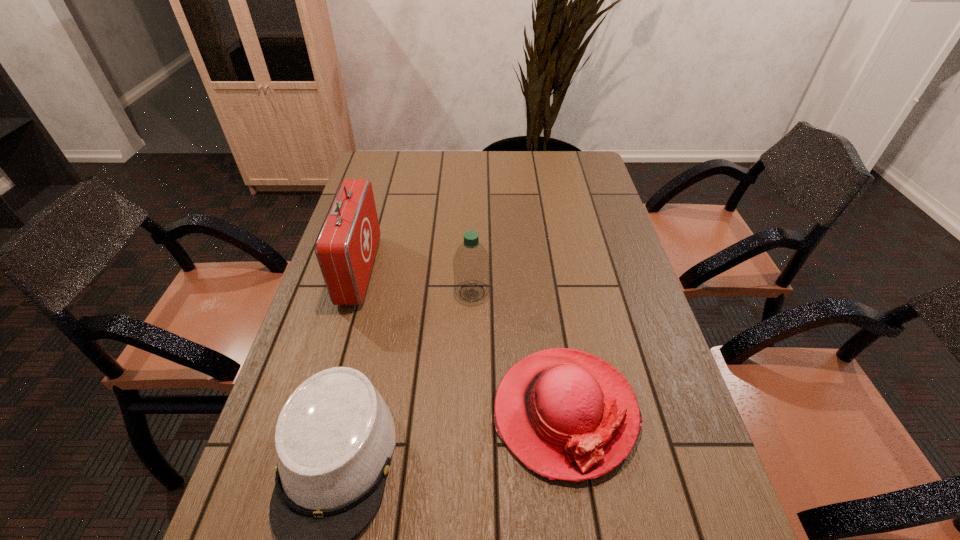
Find the location of a particular element. vacant space at the left edge of the desktop is located at coordinates (342, 349).

Locate an element on the screen. This screenshot has width=960, height=540. vacant space at the right edge is located at coordinates (620, 255).

Image resolution: width=960 pixels, height=540 pixels. In order to click on vacant area at the far right corner of the desktop in this screenshot , I will do point(555,169).

Image resolution: width=960 pixels, height=540 pixels. Find the location of `unoccupied area between the first-aid kit and the water bottle`. unoccupied area between the first-aid kit and the water bottle is located at coordinates (416, 281).

The image size is (960, 540). In order to click on free space between the third shortest object and the first-aid kit in this screenshot , I will do `click(416, 281)`.

The width and height of the screenshot is (960, 540). In order to click on object that can be found as the closest to the third shortest object in this screenshot , I will do `click(566, 414)`.

What are the coordinates of `object that is the second closest to the tallest object` in the screenshot? It's located at (471, 264).

Image resolution: width=960 pixels, height=540 pixels. I want to click on blank area in the image that satisfies the following two spatial constraints: 1. on the side of the first-aid kit with the first aid cross symbol; 2. on the right side of the third object from left to right, so click(353, 292).

Where is `vacant space that satisfies the following two spatial constraints: 1. on the back side of the third object from left to right; 2. on the side of the tallest object with the first aid cross symbol`? This screenshot has width=960, height=540. vacant space that satisfies the following two spatial constraints: 1. on the back side of the third object from left to right; 2. on the side of the tallest object with the first aid cross symbol is located at coordinates (472, 270).